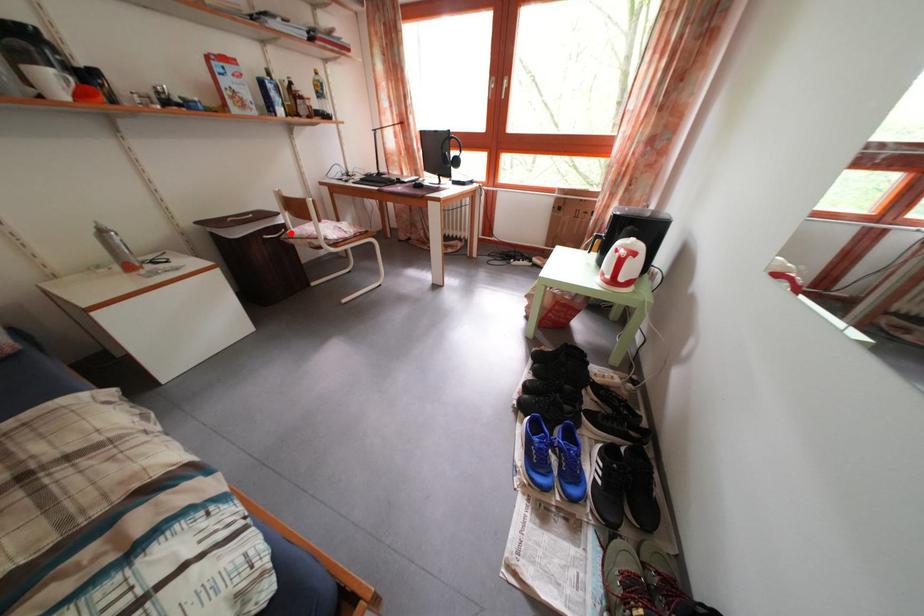
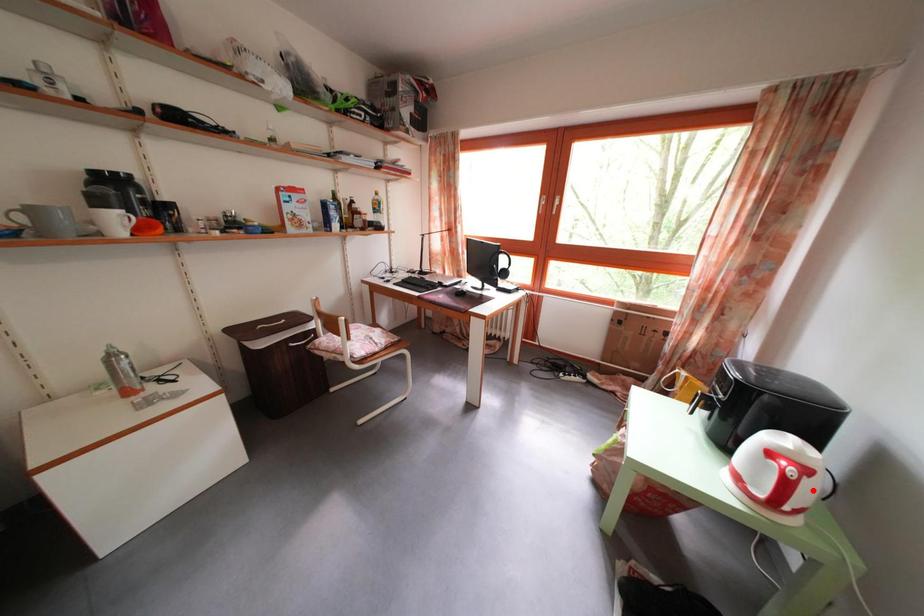
I am providing you with two images of the same scene from different viewpoints. A red point is marked on the first image and another point is marked on the second image. Does the point marked in image1 correspond to the same location as the one in image2?

No